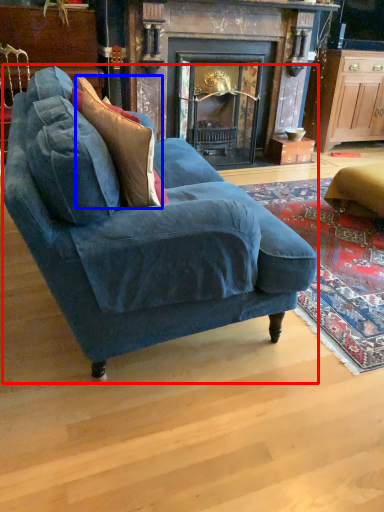
Question: Among these objects, which one is nearest to the camera, studio couch (highlighted by a red box) or throw pillow (highlighted by a blue box)?

Choices:
 (A) studio couch
 (B) throw pillow

Answer: (A)